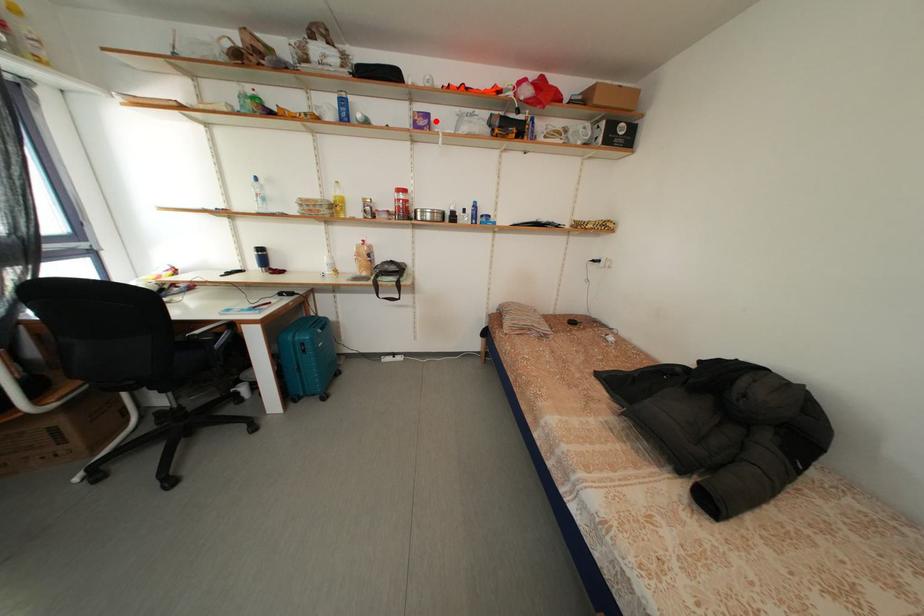
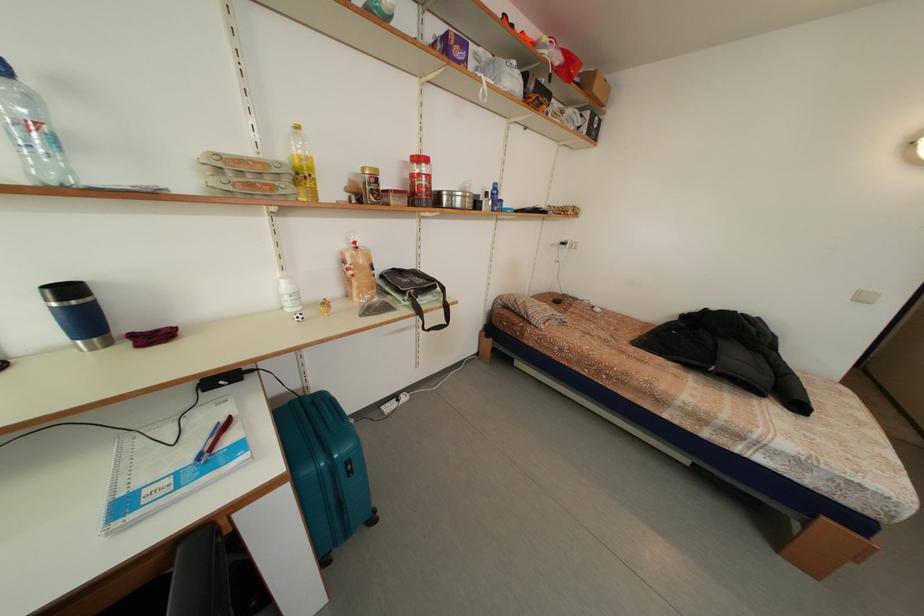
Find the pixel in the second image that matches the highlighted location in the first image.

(472, 51)